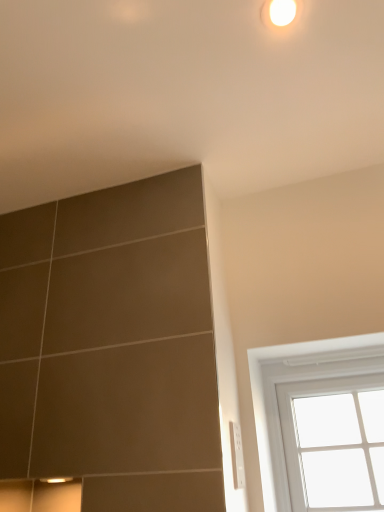
Question: Is white plastic electrical outlet at lower right at the left side of white glass window at upper right?

Choices:
 (A) no
 (B) yes

Answer: (B)

Question: Is white glass window at upper right inside white plastic electrical outlet at lower right?

Choices:
 (A) yes
 (B) no

Answer: (B)

Question: From the image's perspective, is white plastic electrical outlet at lower right located beneath white glass window at upper right?

Choices:
 (A) no
 (B) yes

Answer: (A)

Question: Is white plastic electrical outlet at lower right wider than white glass window at upper right?

Choices:
 (A) yes
 (B) no

Answer: (B)

Question: Is white plastic electrical outlet at lower right aimed at white glass window at upper right?

Choices:
 (A) yes
 (B) no

Answer: (B)

Question: In terms of height, does white plastic electrical outlet at lower right look taller or shorter compared to white glass window at upper right?

Choices:
 (A) tall
 (B) short

Answer: (B)

Question: Considering the positions of white plastic electrical outlet at lower right and white glass window at upper right in the image, is white plastic electrical outlet at lower right bigger or smaller than white glass window at upper right?

Choices:
 (A) big
 (B) small

Answer: (B)

Question: In the image, is white plastic electrical outlet at lower right on the left side or the right side of white glass window at upper right?

Choices:
 (A) left
 (B) right

Answer: (A)

Question: Considering the positions of point (238, 480) and point (377, 338), is point (238, 480) closer or farther from the camera than point (377, 338)?

Choices:
 (A) closer
 (B) farther

Answer: (A)

Question: Choose the correct answer: Is white glossy light at upper center inside white plastic electrical outlet at lower right or outside it?

Choices:
 (A) outside
 (B) inside

Answer: (A)

Question: From a real-world perspective, is white glossy light at upper center above or below white plastic electrical outlet at lower right?

Choices:
 (A) above
 (B) below

Answer: (A)

Question: In terms of size, does white glossy light at upper center appear bigger or smaller than white plastic electrical outlet at lower right?

Choices:
 (A) big
 (B) small

Answer: (B)

Question: Relative to white plastic electrical outlet at lower right, is white glossy light at upper center in front or behind?

Choices:
 (A) front
 (B) behind

Answer: (A)

Question: From a real-world perspective, is white plastic electrical outlet at lower right above or below white glossy light at upper center?

Choices:
 (A) above
 (B) below

Answer: (B)

Question: Considering the positions of point (233, 475) and point (266, 2), is point (233, 475) closer or farther from the camera than point (266, 2)?

Choices:
 (A) closer
 (B) farther

Answer: (B)